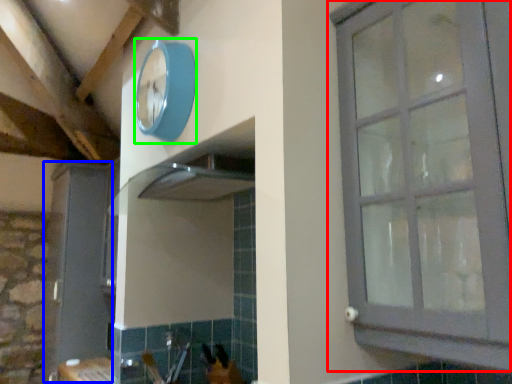
Question: Estimate the real-world distances between objects in this image. Which object is closer to window (highlighted by a red box), screen door (highlighted by a blue box) or clock (highlighted by a green box)?

Choices:
 (A) screen door
 (B) clock

Answer: (B)